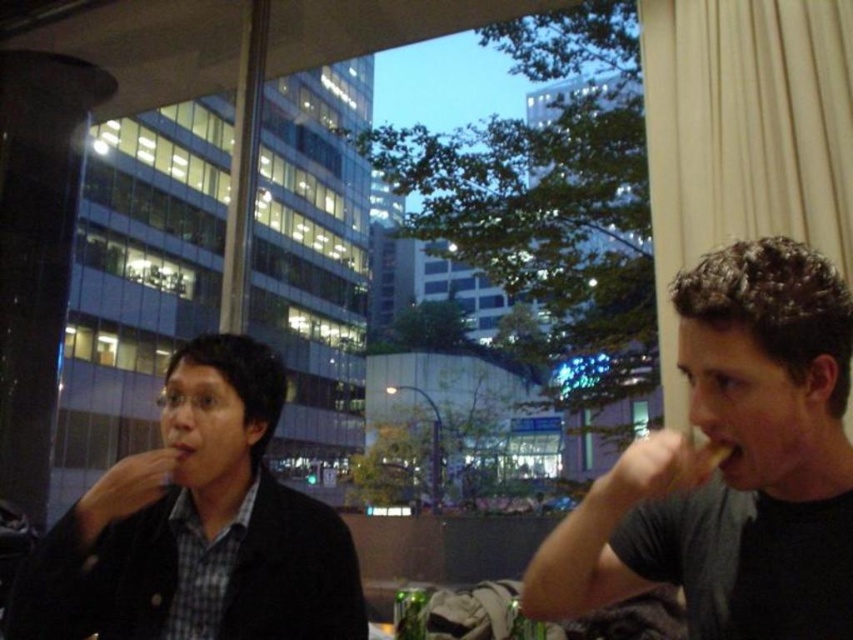
Is black matte shirt at right thinner than matte black jacket at left?

Incorrect, black matte shirt at right's width is not less than matte black jacket at left's.

Does black matte shirt at right appear on the right side of matte black jacket at left?

Indeed, black matte shirt at right is positioned on the right side of matte black jacket at left.

The height and width of the screenshot is (640, 853). What do you see at coordinates (730, 465) in the screenshot?
I see `black matte shirt at right` at bounding box center [730, 465].

Identify the location of black matte shirt at right. (730, 465).